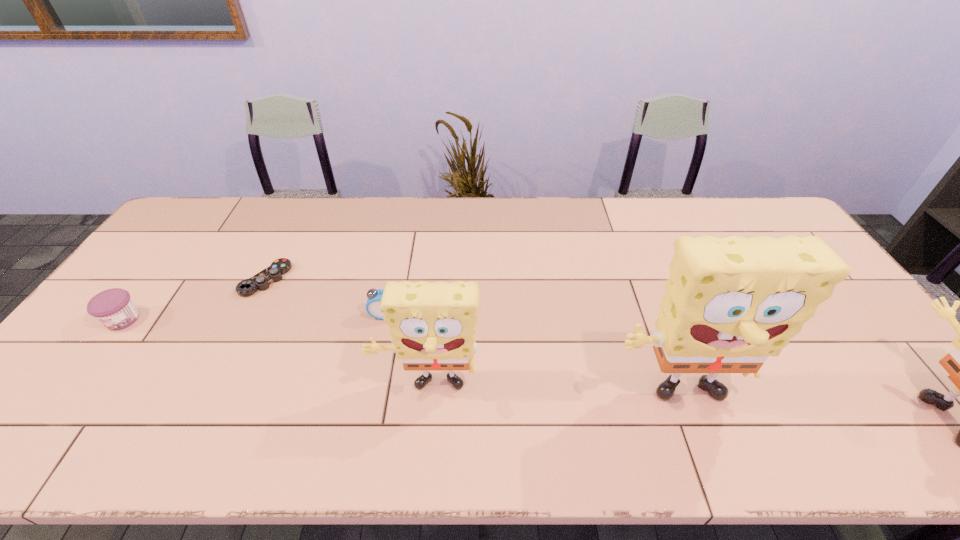
Image resolution: width=960 pixels, height=540 pixels. I want to click on unoccupied area between the second object from right to left and the shortest sponge, so 551,393.

This screenshot has width=960, height=540. I want to click on object that can be found as the third closest to the leftmost sponge, so click(x=273, y=273).

Point out which object is positioned as the nearest to the shortest object. Please provide its 2D coordinates. Your answer should be formatted as a tuple, i.e. [(x, y)], where the tuple contains the x and y coordinates of a point satisfying the conditions above.

[(114, 308)]

The image size is (960, 540). I want to click on sponge that stands as the second closest to the second sponge from right to left, so 959,363.

Where is `the closest sponge to the rightmost sponge`? This screenshot has height=540, width=960. the closest sponge to the rightmost sponge is located at coordinates (730, 303).